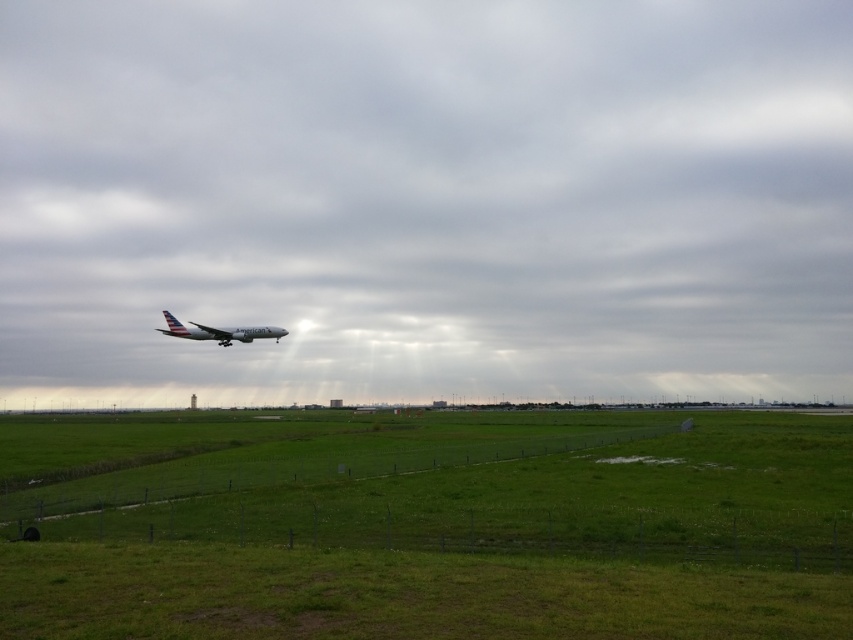
Can you confirm if transparent glass airplane at center is positioned to the left of green grass at lower center?

Correct, you'll find transparent glass airplane at center to the left of green grass at lower center.

Based on the photo, measure the distance from transparent glass airplane at center to green grass at lower center.

The distance of transparent glass airplane at center from green grass at lower center is 70.52 meters.

Find the location of `transparent glass airplane at center`. transparent glass airplane at center is located at coordinates (425, 200).

Is transparent glass airplane at center thinner than silver metallic airplane at center?

No, transparent glass airplane at center is not thinner than silver metallic airplane at center.

Can you confirm if transparent glass airplane at center is positioned above silver metallic airplane at center?

Yes.

Locate an element on the screen. This screenshot has width=853, height=640. transparent glass airplane at center is located at coordinates (425, 200).

Who is lower down, green grass at lower center or silver metallic airplane at center?

Positioned lower is green grass at lower center.

You are a GUI agent. You are given a task and a screenshot of the screen. Output one action in this format:
    pyautogui.click(x=<x>, y=<y>)
    Task: Click on the green grass at lower center
    Image resolution: width=853 pixels, height=640 pixels.
    Given the screenshot: What is the action you would take?
    tap(466, 541)

The width and height of the screenshot is (853, 640). Identify the location of green grass at lower center. (466, 541).